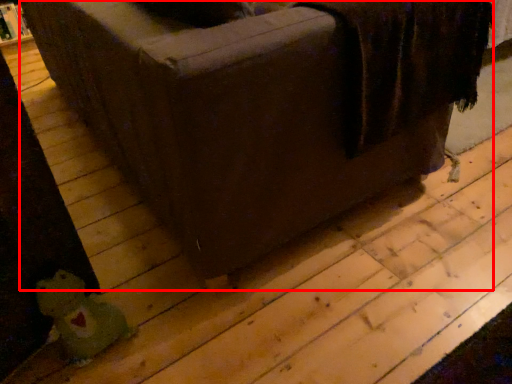
Question: From the image's perspective, where is furniture (annotated by the red box) located in relation to toy in the image?

Choices:
 (A) below
 (B) above

Answer: (B)